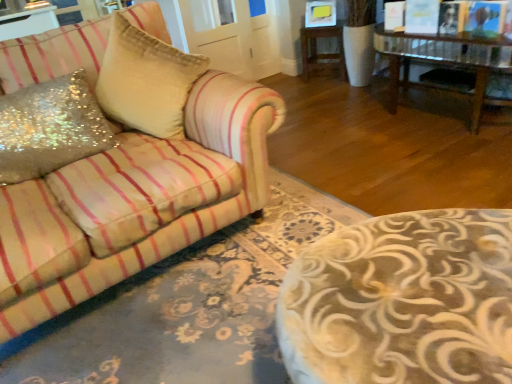
Question: Considering the relative sizes of glittery sequined pillow at left, which is the first throw pillow in left-to-right order, and sequined fabric pillow at left, arranged as the second throw pillow when viewed from the left, in the image provided, is glittery sequined pillow at left, which is the first throw pillow in left-to-right order, shorter than sequined fabric pillow at left, arranged as the second throw pillow when viewed from the left,?

Choices:
 (A) yes
 (B) no

Answer: (A)

Question: Is glittery sequined pillow at left, which is the first throw pillow in left-to-right order, facing away from sequined fabric pillow at left, the 1th throw pillow viewed from the right?

Choices:
 (A) no
 (B) yes

Answer: (A)

Question: Considering the relative sizes of glittery sequined pillow at left, which is the second throw pillow from right to left, and sequined fabric pillow at left, arranged as the second throw pillow when viewed from the left, in the image provided, is glittery sequined pillow at left, which is the second throw pillow from right to left, thinner than sequined fabric pillow at left, arranged as the second throw pillow when viewed from the left,?

Choices:
 (A) no
 (B) yes

Answer: (B)

Question: Considering the relative sizes of glittery sequined pillow at left, which is the first throw pillow in left-to-right order, and sequined fabric pillow at left, the 1th throw pillow viewed from the right, in the image provided, is glittery sequined pillow at left, which is the first throw pillow in left-to-right order, smaller than sequined fabric pillow at left, the 1th throw pillow viewed from the right,?

Choices:
 (A) no
 (B) yes

Answer: (B)

Question: Is glittery sequined pillow at left, which is the second throw pillow from right to left, further to the viewer compared to sequined fabric pillow at left, arranged as the second throw pillow when viewed from the left?

Choices:
 (A) no
 (B) yes

Answer: (A)

Question: Would you say glittery sequined pillow at left, which is the first throw pillow in left-to-right order, contains sequined fabric pillow at left, arranged as the second throw pillow when viewed from the left?

Choices:
 (A) yes
 (B) no

Answer: (B)

Question: Considering the relative sizes of glittery sequined pillow at left, which is the first throw pillow in left-to-right order, and wooden side table at center in the image provided, is glittery sequined pillow at left, which is the first throw pillow in left-to-right order, bigger than wooden side table at center?

Choices:
 (A) yes
 (B) no

Answer: (B)

Question: Is wooden side table at center at the back of glittery sequined pillow at left, which is the first throw pillow in left-to-right order?

Choices:
 (A) no
 (B) yes

Answer: (A)

Question: From the image's perspective, is glittery sequined pillow at left, which is the second throw pillow from right to left, above wooden side table at center?

Choices:
 (A) yes
 (B) no

Answer: (B)

Question: Is glittery sequined pillow at left, which is the second throw pillow from right to left, positioned behind wooden side table at center?

Choices:
 (A) yes
 (B) no

Answer: (B)

Question: Does glittery sequined pillow at left, which is the first throw pillow in left-to-right order, have a greater height compared to wooden side table at center?

Choices:
 (A) no
 (B) yes

Answer: (A)

Question: Is glittery sequined pillow at left, which is the second throw pillow from right to left, positioned in front of wooden side table at center?

Choices:
 (A) no
 (B) yes

Answer: (B)

Question: Considering the relative sizes of wooden side table at center and glittery sequined pillow at left, which is the first throw pillow in left-to-right order, in the image provided, is wooden side table at center wider than glittery sequined pillow at left, which is the first throw pillow in left-to-right order,?

Choices:
 (A) yes
 (B) no

Answer: (A)